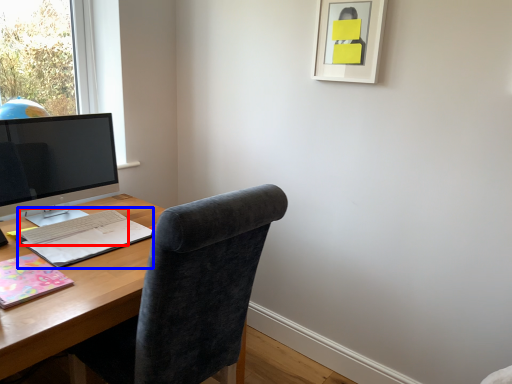
Question: Among these objects, which one is farthest to the camera, computer keyboard (highlighted by a red box) or notebook (highlighted by a blue box)?

Choices:
 (A) computer keyboard
 (B) notebook

Answer: (A)